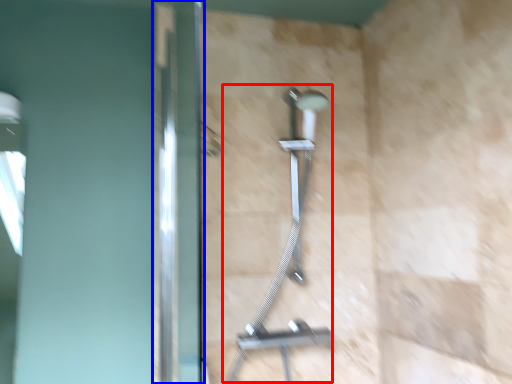
Question: Among these objects, which one is nearest to the camera, shower (highlighted by a red box) or screen door (highlighted by a blue box)?

Choices:
 (A) shower
 (B) screen door

Answer: (B)